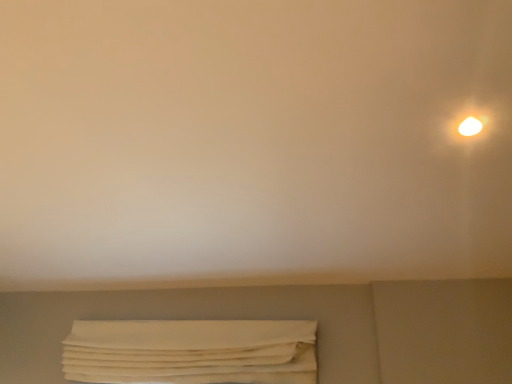
The image size is (512, 384). What do you see at coordinates (191, 351) in the screenshot?
I see `white fabric towel at lower center` at bounding box center [191, 351].

At what (x,y) coordinates should I click in order to perform the action: click on white fabric towel at lower center. Please return your answer as a coordinate pair (x, y). The width and height of the screenshot is (512, 384). Looking at the image, I should click on (191, 351).

This screenshot has height=384, width=512. I want to click on white fabric towel at lower center, so (191, 351).